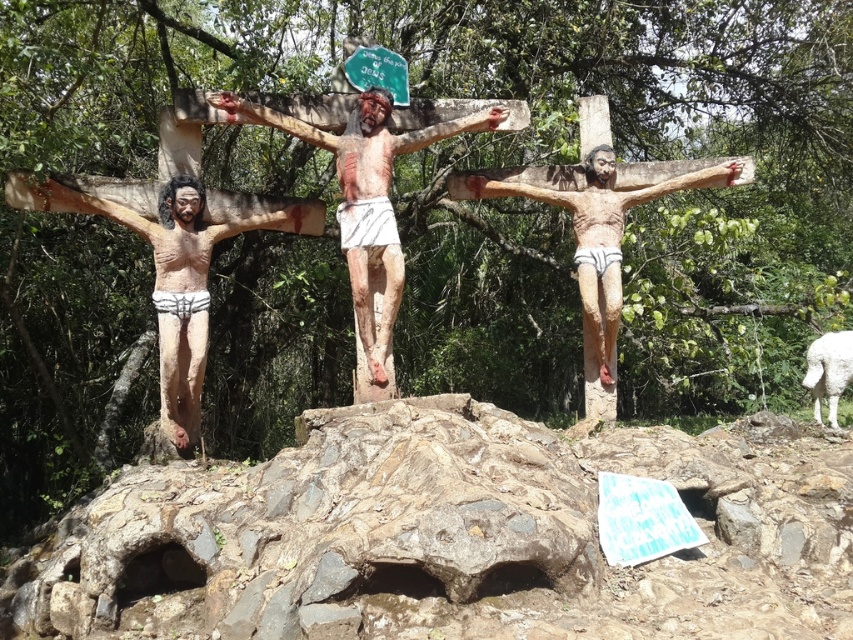
Between matte wood crucifix at left and wooden statue at center, which one is positioned lower?

matte wood crucifix at left

Is matte wood crucifix at left wider than wooden statue at center?

No, matte wood crucifix at left is not wider than wooden statue at center.

Who is more distant from viewer, (167, 365) or (369, 192)?

The point (369, 192) is more distant.

In order to click on matte wood crucifix at left in this screenshot , I will do `click(173, 275)`.

Who is lower down, matte wood crucifix at left or wooden crucifix at center?

matte wood crucifix at left is lower down.

Does matte wood crucifix at left lie in front of wooden crucifix at center?

Yes, matte wood crucifix at left is closer to the viewer.

Who is more forward, [202,205] or [579,269]?

Positioned in front is point [202,205].

Locate an element on the screen. The height and width of the screenshot is (640, 853). matte wood crucifix at left is located at coordinates (173, 275).

Measure the distance between point [364,252] and camera.

6.85 meters

Between wooden statue at center and wooden crucifix at center, which one has more height?

wooden statue at center is taller.

The image size is (853, 640). Identify the location of wooden statue at center. (367, 205).